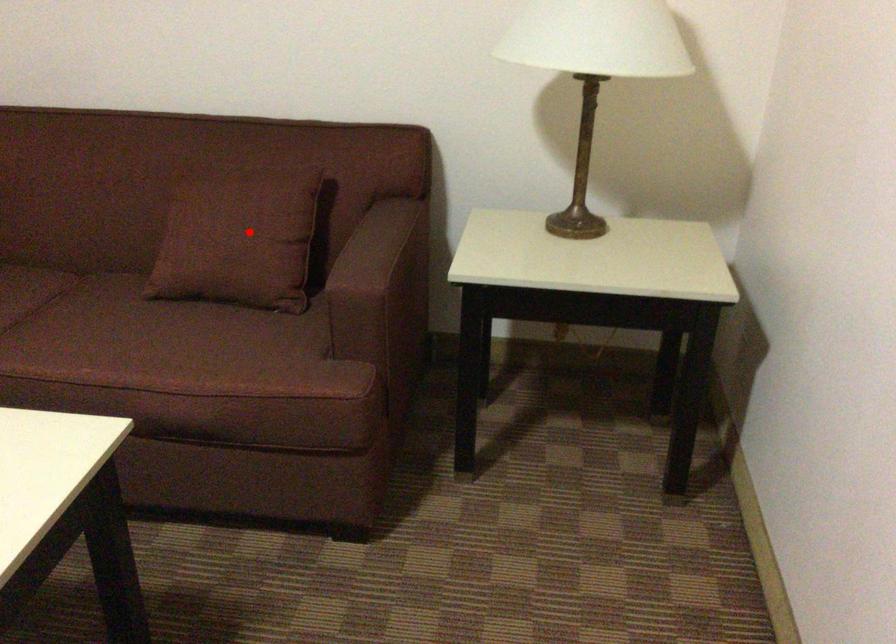
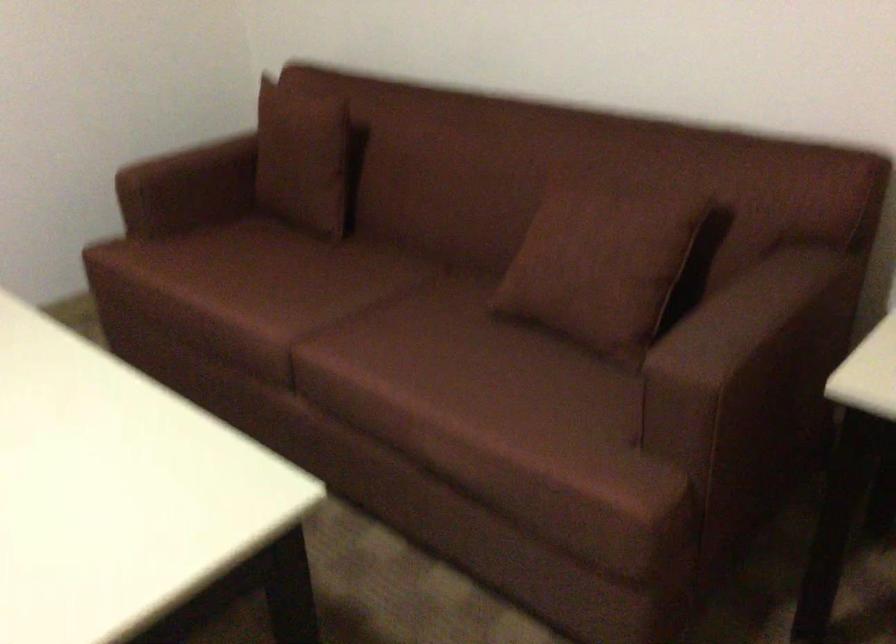
Locate, in the second image, the point that corresponds to the highlighted location in the first image.

(600, 263)